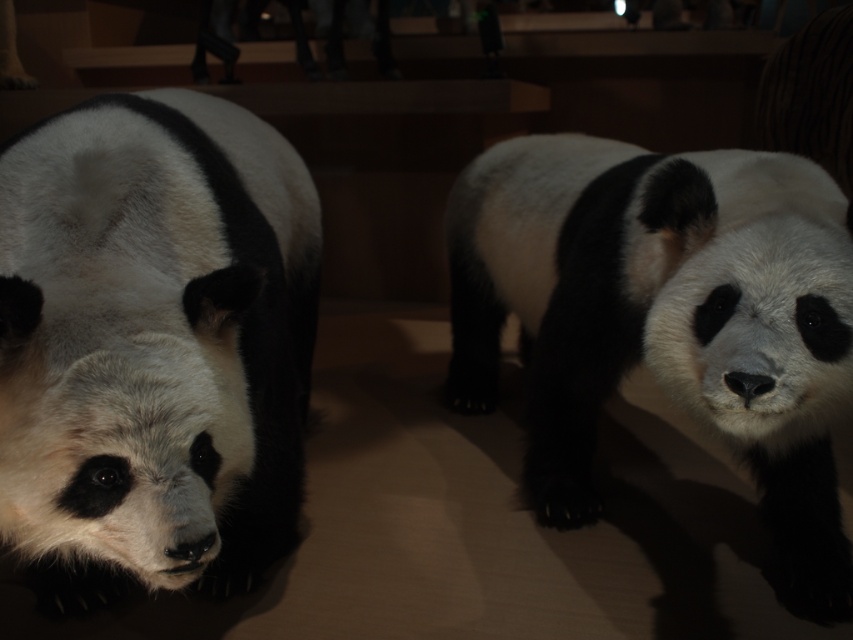
You are a museum visitor standing at the entrance of the exhibit. You see the black and white fur panda at left and the black and white fur panda at center. Which panda is closer to you?

The black and white fur panda at left is closer to you because it is in front of the black and white fur panda at center.

You are a visitor in the museum and want to take a photo of both pandas. Since the lighting is dim, you need to ensure both pandas are fully visible. Given that the black and white fur panda at left is shorter than the black and white fur panda at center, which panda should you focus on first to make sure the taller one is properly lit?

The black and white fur panda at center is taller. Since it is taller, it might be positioned under a brighter light source. Focus on adjusting the camera settings to capture the taller panda first to ensure proper exposure, then adjust for the shorter one if needed.

You are standing in a museum and see the black and white fur panda at left. Can you tell me the exact coordinates where it is located?

The black and white fur panda at left is located at coordinates point (154,342).